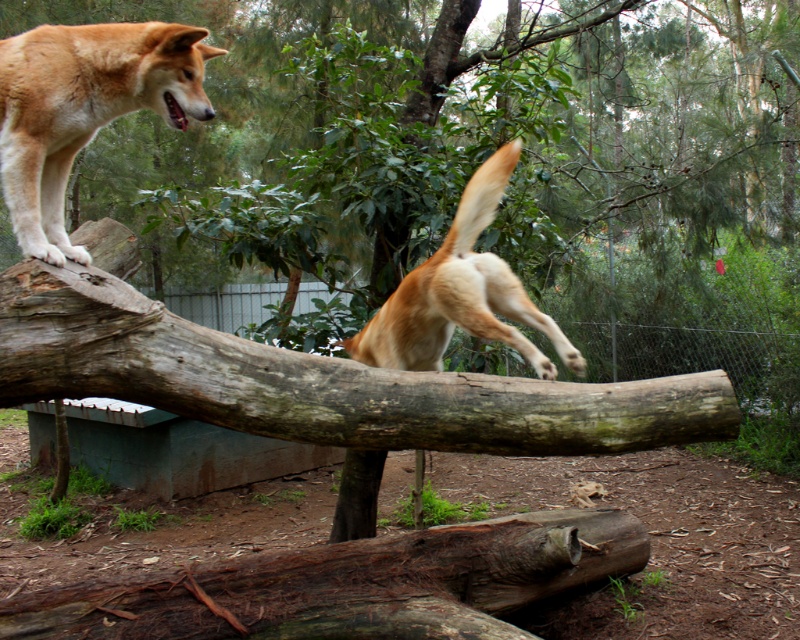
You are observing two points in the image. The first point is labeled as point [112,586] and the second is point [32,129]. Based on their positions, which point is closer to the foreground of the scene?

Point [32,129] is closer to the foreground because it is in front of point [112,586].

You are a wildlife photographer observing two golden fur dogs in an outdoor enclosure. You notice both the golden fur dog at upper left and the golden fur dog at center. Which dog is located higher up in the image?

The golden fur dog at upper left is positioned over the golden fur dog at center, meaning it is higher up in the image.